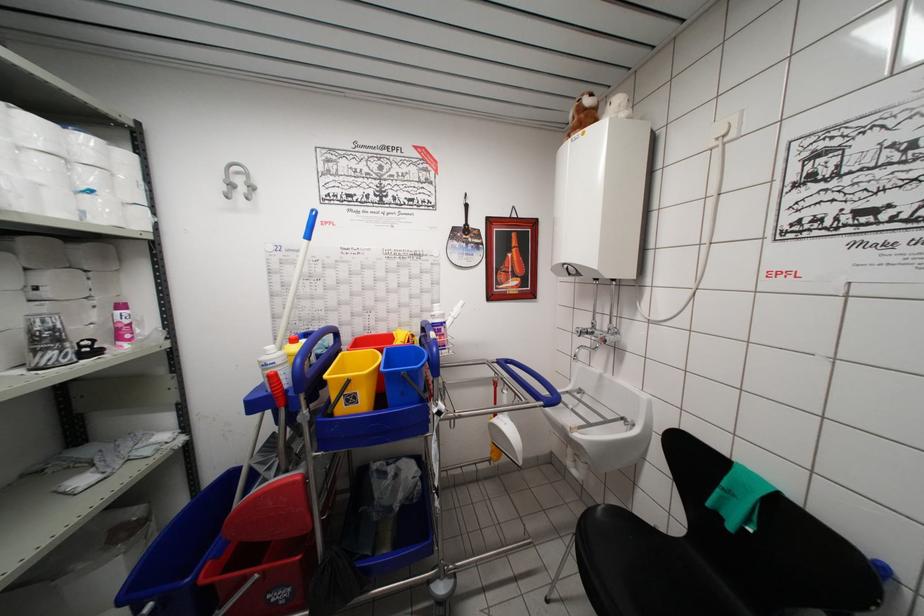
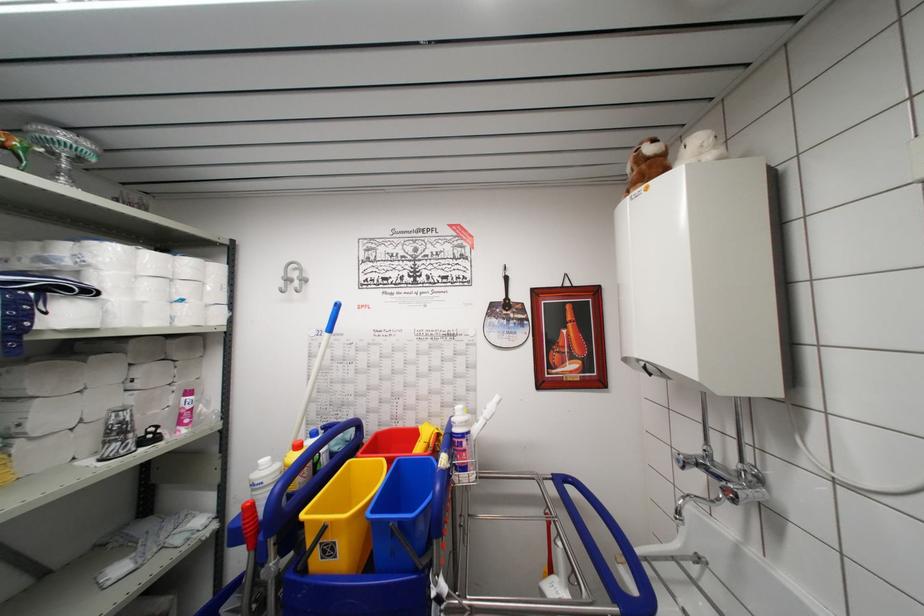
Find the pixel in the second image that matches point 469,238 in the first image.

(511, 313)